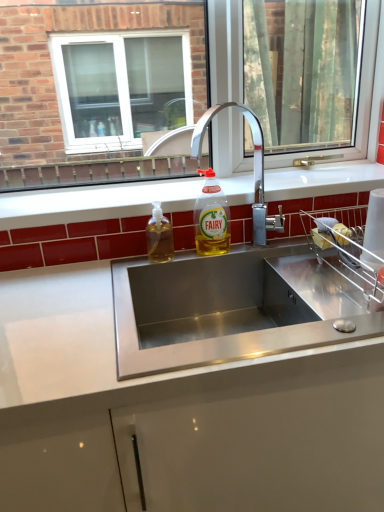
Question: Does point (152, 302) appear closer or farther from the camera than point (160, 218)?

Choices:
 (A) farther
 (B) closer

Answer: (B)

Question: From a real-world perspective, is stainless steel sink at center positioned above or below translucent plastic soap dispenser at sink left, which appears as the 1th bottle when viewed from the left?

Choices:
 (A) above
 (B) below

Answer: (A)

Question: Estimate the real-world distances between objects in this image. Which object is farther from the translucent plastic soap dispenser at sink left, the 2th bottle in the right-to-left sequence?

Choices:
 (A) chrome metallic faucet at center
 (B) stainless steel sink at center
 (C) white glossy countertop at center
 (D) clear glass window at center
 (E) yellow translucent liquid at sink center, which appears as the first bottle when viewed from the right

Answer: (D)

Question: Estimate the real-world distances between objects in this image. Which object is farther from the chrome metallic faucet at center?

Choices:
 (A) stainless steel sink at center
 (B) white glossy countertop at center
 (C) translucent plastic soap dispenser at sink left, the 2th bottle in the right-to-left sequence
 (D) clear glass window at center
 (E) yellow translucent liquid at sink center, which ranks as the 2th bottle in left-to-right order

Answer: (D)